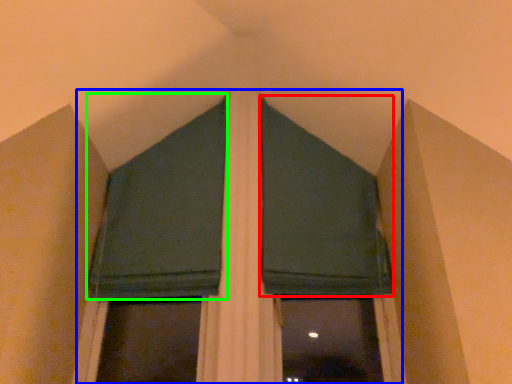
Question: Which object is positioned farthest from curtain (highlighted by a red box)? Select from bay window (highlighted by a blue box) and curtain (highlighted by a green box).

Choices:
 (A) bay window
 (B) curtain

Answer: (B)